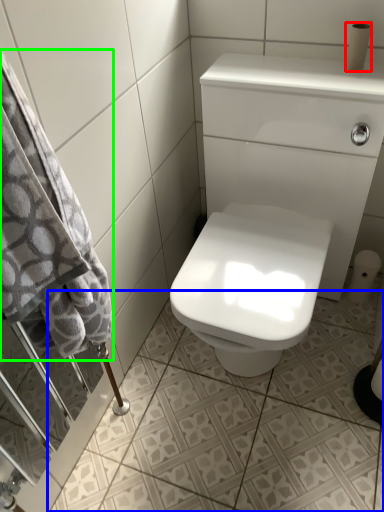
Question: Considering the real-world distances, which object is closest to toilet paper (highlighted by a red box)? ceramic tile (highlighted by a blue box) or bath towel (highlighted by a green box).

Choices:
 (A) ceramic tile
 (B) bath towel

Answer: (B)